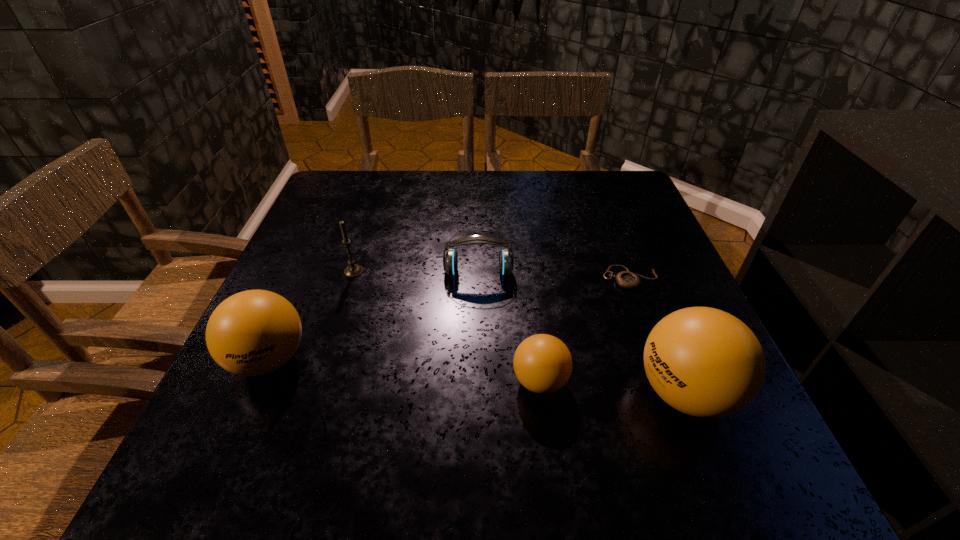
Identify the location of the second tallest ping-pong ball. (252, 333).

You are a GUI agent. You are given a task and a screenshot of the screen. Output one action in this format:
    pyautogui.click(x=<x>, y=<y>)
    Task: Click on the leftmost ping-pong ball
    The image size is (960, 540).
    Given the screenshot: What is the action you would take?
    pyautogui.click(x=252, y=333)

This screenshot has height=540, width=960. Find the location of `the second ping-pong ball from right to left`. the second ping-pong ball from right to left is located at coordinates (542, 363).

Locate an element on the screen. the rightmost ping-pong ball is located at coordinates tap(704, 362).

Where is `candle`? The height and width of the screenshot is (540, 960). candle is located at coordinates (353, 270).

Identify the location of headset. (450, 263).

Identify the location of the shortest object. This screenshot has height=540, width=960. (628, 280).

The width and height of the screenshot is (960, 540). Identify the location of free space located on the side with brand of the shortest ping-pong ball. (675, 381).

I want to click on vacant region located on the side with brand of the rightmost ping-pong ball, so click(560, 393).

The image size is (960, 540). Identify the location of free location located 0.290m on the side with brand of the rightmost ping-pong ball. (468, 393).